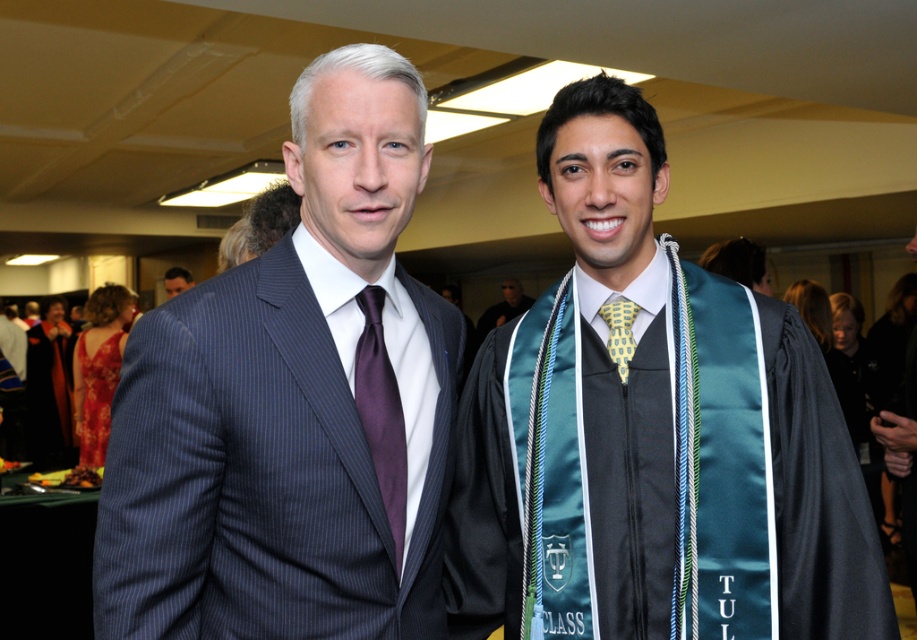
Question: Is matte black suit at left positioned before matte black suit at center?

Choices:
 (A) yes
 (B) no

Answer: (A)

Question: Which point appears closest to the camera in this image?

Choices:
 (A) (116, 371)
 (B) (507, 289)
 (C) (371, 372)

Answer: (C)

Question: Is teal satin sash at center to the left of blue fabric tie at left from the viewer's perspective?

Choices:
 (A) yes
 (B) no

Answer: (B)

Question: Which object is positioned farthest from the matte black suit at center?

Choices:
 (A) matte black suit at left
 (B) blue fabric tie at left
 (C) matte pinstripe suit at left
 (D) purple satin tie at center

Answer: (D)

Question: Based on their relative distances, which object is farther from the matte black suit at left?

Choices:
 (A) purple satin tie at center
 (B) matte black suit at center
 (C) matte pinstripe suit at left

Answer: (A)

Question: Is purple satin tie at center bigger than matte black suit at center?

Choices:
 (A) no
 (B) yes

Answer: (A)